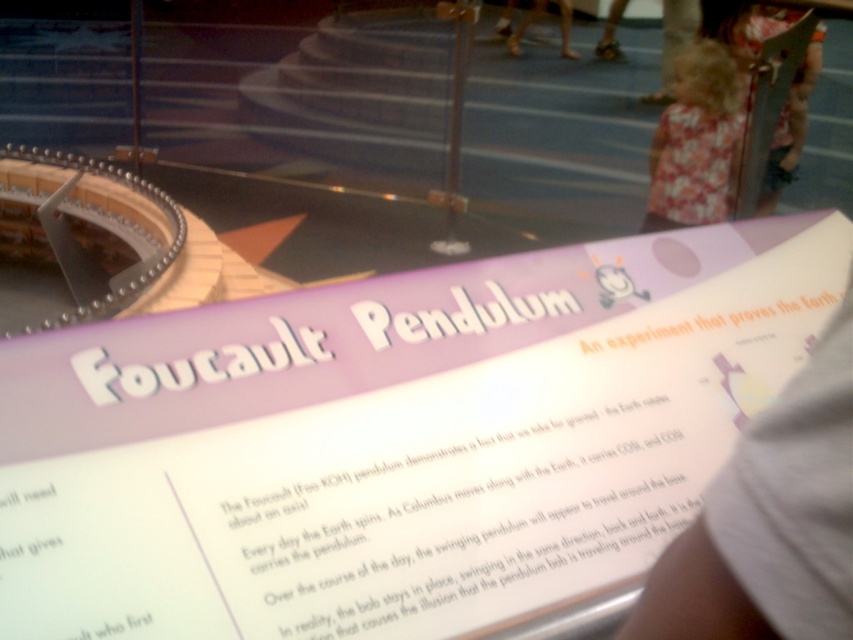
You are a visitor at the science museum and want to read the information on the white paper sign at center and the fluffy pink dress at upper right. Which object is wider?

The white paper sign at center is wider than the fluffy pink dress at upper right.

You are a visitor at the science museum and want to read the sign about the Foucault Pendulum. However, there is a white fabric at lower right and a fluffy pink dress at upper right in your way. Which object is closer to you, the visitor?

The white fabric at lower right is closer to you because it is in front of the fluffy pink dress at upper right.

You are a museum visitor who wants to read the white paper sign at center but is currently standing near the fluffy pink dress at upper right. Can you reach the sign without moving your position? Please explain using the distance provided.

The distance between the white paper sign at center and the fluffy pink dress at upper right is 7.69 feet. Since 7.69 feet is approximately 2.34 meters, and the average person can only reach about 2 meters without moving, you would need to take a step forward to reach the sign.